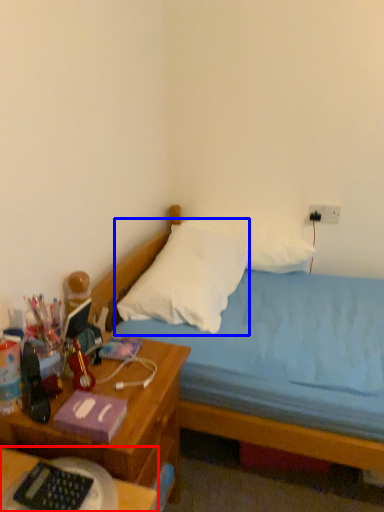
Question: Which object appears closest to the camera in this image, desk (highlighted by a red box) or pillow (highlighted by a blue box)?

Choices:
 (A) desk
 (B) pillow

Answer: (A)